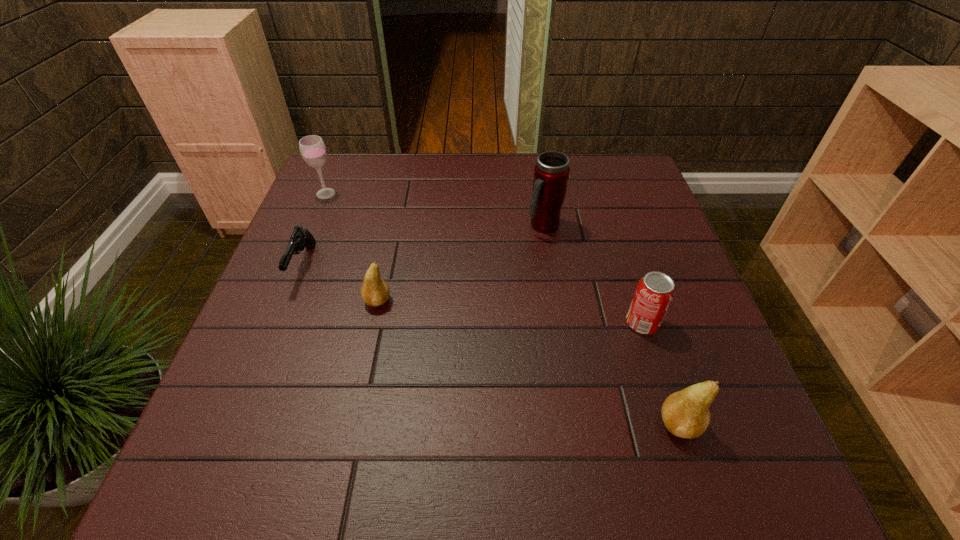
Image resolution: width=960 pixels, height=540 pixels. Find the location of `vacant point located 0.180m on the front of the left pear`. vacant point located 0.180m on the front of the left pear is located at coordinates (360, 385).

The width and height of the screenshot is (960, 540). I want to click on free space located on the back of the nearer pear, so click(x=637, y=299).

This screenshot has width=960, height=540. Find the location of `vacant space positioned on the side with the handle of the fourth object from left to right`. vacant space positioned on the side with the handle of the fourth object from left to right is located at coordinates (552, 276).

Where is `vacant area located on the front of the second tallest object`? This screenshot has width=960, height=540. vacant area located on the front of the second tallest object is located at coordinates (315, 220).

The image size is (960, 540). What are the coordinates of `vacant position located 0.120m on the front of the soda can` in the screenshot? It's located at (663, 388).

I want to click on blank space located 0.210m at the end of the barrel of the gun, so click(260, 373).

The width and height of the screenshot is (960, 540). Identify the location of object that is positioned at the far edge. (312, 148).

Where is `object present at the near edge`? object present at the near edge is located at coordinates (686, 414).

Image resolution: width=960 pixels, height=540 pixels. In order to click on wineglass positioned at the left edge in this screenshot , I will do `click(312, 148)`.

Locate an element on the screen. This screenshot has width=960, height=540. gun present at the left edge is located at coordinates (301, 238).